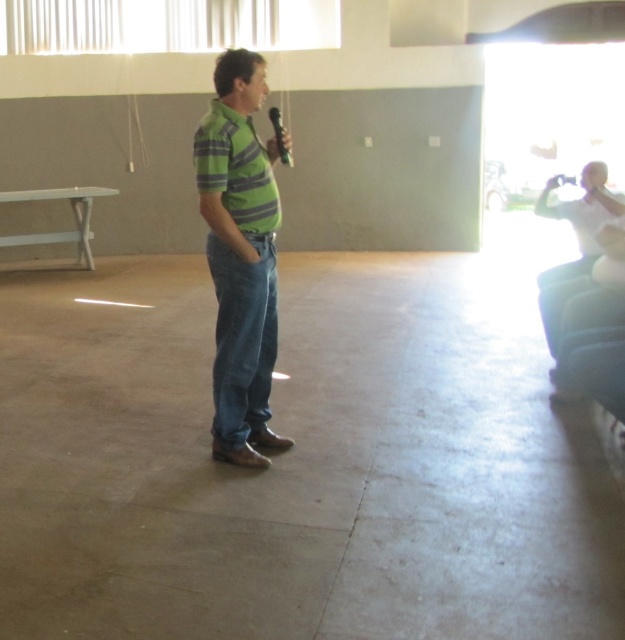
Question: Can you confirm if green striped shirt at center is positioned to the right of metallic shiny microphone at center?

Choices:
 (A) no
 (B) yes

Answer: (A)

Question: Which object appears closest to the camera in this image?

Choices:
 (A) metallic shiny microphone at center
 (B) green striped shirt at center

Answer: (B)

Question: Is green striped shirt at center to the left of metallic shiny microphone at center from the viewer's perspective?

Choices:
 (A) yes
 (B) no

Answer: (A)

Question: Which of the following is the closest to the observer?

Choices:
 (A) metallic shiny microphone at center
 (B) green striped shirt at center

Answer: (B)

Question: Can you confirm if green striped shirt at center is positioned above metallic shiny microphone at center?

Choices:
 (A) yes
 (B) no

Answer: (B)